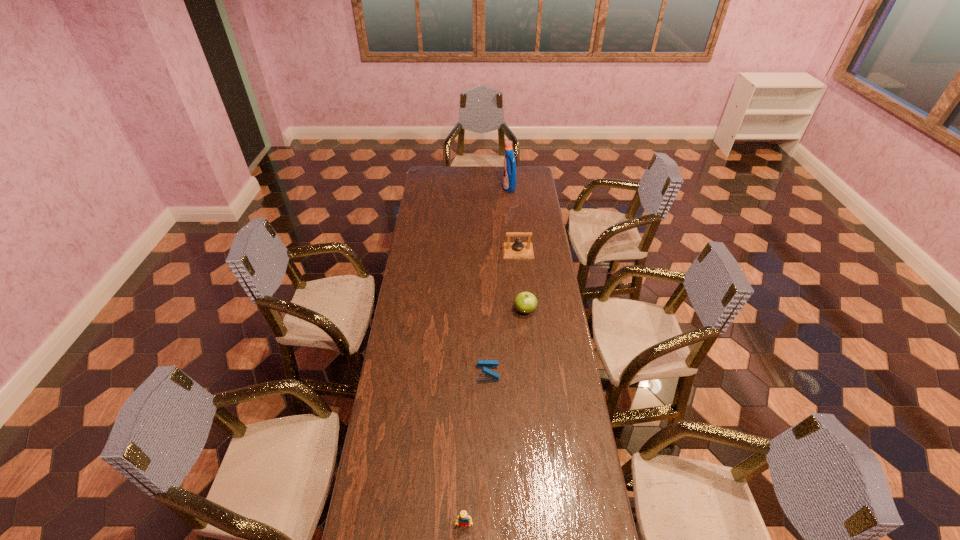
Locate an element on the screen. vacant space situated on the label of the tallest object is located at coordinates (481, 188).

This screenshot has height=540, width=960. In order to click on vacant space located on the back of the bell in this screenshot , I will do `click(516, 227)`.

You are a GUI agent. You are given a task and a screenshot of the screen. Output one action in this format:
    pyautogui.click(x=<x>, y=<y>)
    Task: Click on the blank space located on the left of the apple
    This screenshot has width=960, height=540.
    Given the screenshot: What is the action you would take?
    pyautogui.click(x=461, y=310)

Locate an element on the screen. This screenshot has height=540, width=960. vacant space located on the front of the fourth farthest object is located at coordinates (x=490, y=475).

Locate an element on the screen. The width and height of the screenshot is (960, 540). object situated at the far edge is located at coordinates (509, 181).

The width and height of the screenshot is (960, 540). Find the location of `detergent that is positioned at the right edge`. detergent that is positioned at the right edge is located at coordinates (509, 181).

You are a GUI agent. You are given a task and a screenshot of the screen. Output one action in this format:
    pyautogui.click(x=<x>, y=<y>)
    Task: Click on the bell that is at the right edge
    
    Given the screenshot: What is the action you would take?
    pyautogui.click(x=518, y=249)

Where is `apple situated at the right edge`? The height and width of the screenshot is (540, 960). apple situated at the right edge is located at coordinates (525, 302).

Find the location of a particular element. object present at the far right corner is located at coordinates (509, 181).

Where is `blank space at the far edge of the desktop`? The height and width of the screenshot is (540, 960). blank space at the far edge of the desktop is located at coordinates (450, 179).